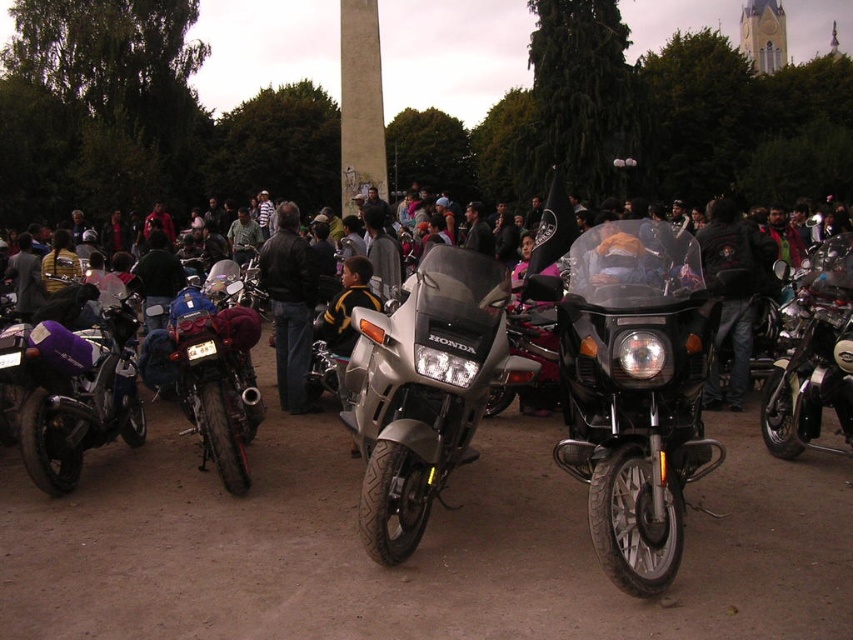
Does black matte motorcycle at center have a greater height compared to purple matte bag at left?

Yes.

Measure the distance between point (682, 417) and camera.

Point (682, 417) is 32.71 meters away from camera.

What do you see at coordinates (634, 392) in the screenshot? This screenshot has height=640, width=853. I see `black matte motorcycle at center` at bounding box center [634, 392].

Locate an element on the screen. Image resolution: width=853 pixels, height=640 pixels. black matte motorcycle at center is located at coordinates (634, 392).

Between black matte motorcycle at center and black leather jacket at center, which one appears on the left side from the viewer's perspective?

black leather jacket at center

Can you confirm if black matte motorcycle at center is thinner than black leather jacket at center?

Incorrect, black matte motorcycle at center's width is not less than black leather jacket at center's.

Is point (692, 385) positioned before point (289, 300)?

Yes, point (692, 385) is in front of point (289, 300).

Where is `black matte motorcycle at center`? This screenshot has width=853, height=640. black matte motorcycle at center is located at coordinates (634, 392).

Can you confirm if purple matte bag at left is smaller than brushed metal motorcycle at center?

Correct, purple matte bag at left occupies less space than brushed metal motorcycle at center.

Between purple matte bag at left and brushed metal motorcycle at center, which one has more height?

With more height is brushed metal motorcycle at center.

Between point (126, 404) and point (238, 316), which one is positioned behind?

The point (238, 316) is more distant.

I want to click on purple matte bag at left, so click(x=73, y=387).